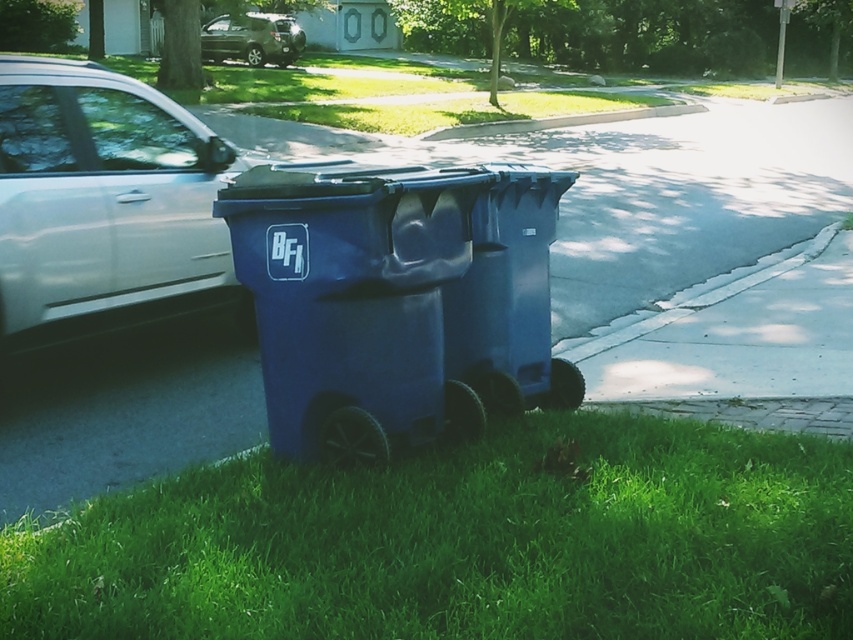
You are a gardener who wants to mow the lawn. You see the green grass at lower center and the blue plastic trash can at center. Which area is shorter and easier to mow first?

The green grass at lower center has a lesser height compared to the blue plastic trash can at center, so it is shorter and easier to mow first.

You are a delivery person who needs to place a package between the blue plastic trash can at center and the satin silver suv at upper center. The package requires a space of 50 feet. Is there enough space between them?

The blue plastic trash can at center and the satin silver suv at upper center are 51.55 feet apart, so yes, there is enough space between them to place the package as the distance is greater than the required 50 feet.

In the scene shown: You are a delivery person with a 1.5 meter wide cart. You need to navigate between the green grass at lower center and the satin silver car at left to reach the recycling bins. Can your cart fit through the space between them?

The green grass at lower center and the satin silver car at left are 1.77 meters apart. Since your cart is 1.5 meters wide, it can fit through the space between them as the distance is wider than the cart.